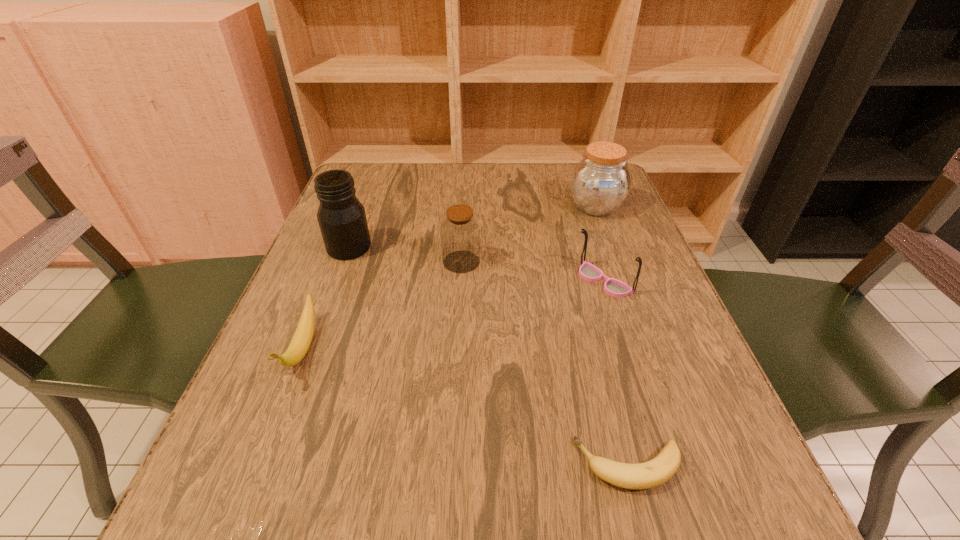
At what (x,y) coordinates should I click in order to perform the action: click on vacant space that is in between the shorter banana and the farthest jar. Please return your answer as a coordinate pair (x, y). This screenshot has width=960, height=540. Looking at the image, I should click on (612, 336).

Find the location of a particular element. This screenshot has height=540, width=960. empty space between the third object from left to right and the leftmost jar is located at coordinates (405, 254).

Identify which object is the fourth closest to the fourth shortest object. Please provide its 2D coordinates. Your answer should be formatted as a tuple, i.e. [(x, y)], where the tuple contains the x and y coordinates of a point satisfying the conditions above.

[(601, 181)]

Choose which object is the third nearest neighbor to the spectacles. Please provide its 2D coordinates. Your answer should be formatted as a tuple, i.e. [(x, y)], where the tuple contains the x and y coordinates of a point satisfying the conditions above.

[(657, 471)]

Select which jar is the third closest to the right banana. Please provide its 2D coordinates. Your answer should be formatted as a tuple, i.e. [(x, y)], where the tuple contains the x and y coordinates of a point satisfying the conditions above.

[(601, 181)]

Identify which jar is located as the nearest to the shortest jar. Please provide its 2D coordinates. Your answer should be formatted as a tuple, i.e. [(x, y)], where the tuple contains the x and y coordinates of a point satisfying the conditions above.

[(342, 220)]